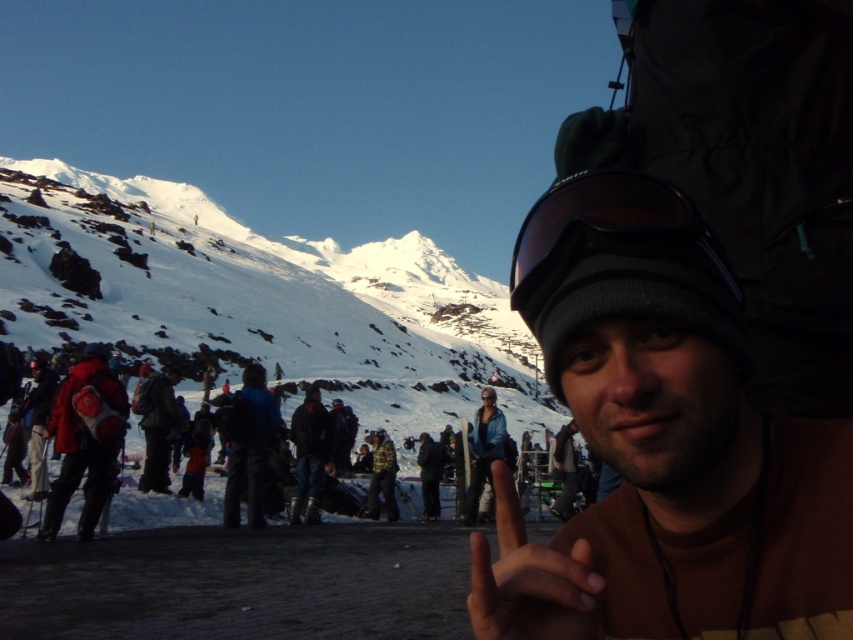
Which of these two, dark matte hand at center or blue fabric jacket at center, stands taller?

With more height is blue fabric jacket at center.

How far apart are dark matte hand at center and blue fabric jacket at center?

41.55 meters

The height and width of the screenshot is (640, 853). Identify the location of dark matte hand at center. (529, 579).

Image resolution: width=853 pixels, height=640 pixels. I want to click on dark matte hand at center, so click(529, 579).

Is red matte backpack at left smaller than blue fabric jacket at center?

No, red matte backpack at left is not smaller than blue fabric jacket at center.

In the scene shown: Who is more distant from viewer, (103, 460) or (231, 513)?

Positioned behind is point (231, 513).

The image size is (853, 640). I want to click on red matte backpack at left, so click(x=85, y=440).

Consider the image. Which is more to the left, brown woolen hat at center or red matte backpack at left?

red matte backpack at left

Does brown woolen hat at center lie behind red matte backpack at left?

No, it is in front of red matte backpack at left.

Is point (535, 308) closer to viewer compared to point (80, 520)?

Yes, it is.

Where is `brown woolen hat at center`? This screenshot has width=853, height=640. brown woolen hat at center is located at coordinates (663, 442).